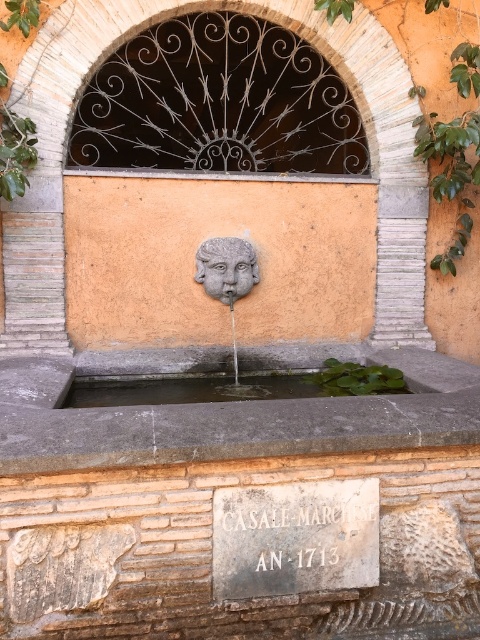
Locate an element on the screen. This screenshot has width=480, height=640. dark wrought iron arch at upper center is located at coordinates (217, 104).

Does point (358, 140) come closer to viewer compared to point (235, 376)?

No.

The width and height of the screenshot is (480, 640). In order to click on dark wrought iron arch at upper center in this screenshot , I will do `click(217, 104)`.

Does clear water at center appear on the left side of matte stone face at center?

No, clear water at center is not to the left of matte stone face at center.

Does point (348, 369) lie behind point (200, 276)?

No.

Is point (240, 380) farther from camera compared to point (236, 256)?

Yes, point (240, 380) is farther from viewer.

I want to click on clear water at center, so click(235, 387).

This screenshot has width=480, height=640. Describe the element at coordinates (217, 104) in the screenshot. I see `dark wrought iron arch at upper center` at that location.

Between point (229, 38) and point (344, 387), which one is positioned in front?

Point (344, 387)

What do you see at coordinates (217, 104) in the screenshot? This screenshot has height=640, width=480. I see `dark wrought iron arch at upper center` at bounding box center [217, 104].

Where is `dark wrought iron arch at upper center`? The width and height of the screenshot is (480, 640). dark wrought iron arch at upper center is located at coordinates (217, 104).